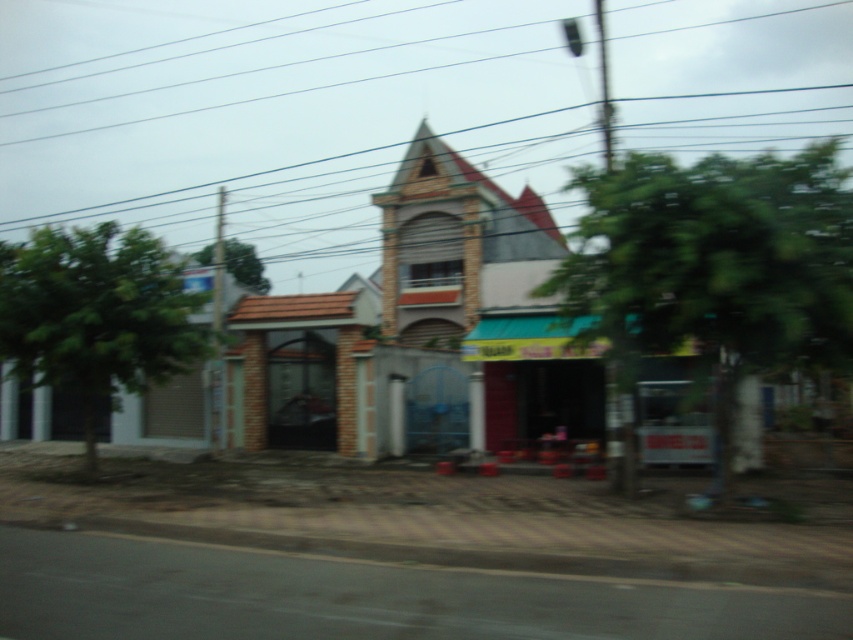
Who is positioned more to the right, green leafy tree at center or green leafy tree at upper center?

green leafy tree at center

This screenshot has width=853, height=640. What do you see at coordinates (717, 266) in the screenshot? I see `green leafy tree at center` at bounding box center [717, 266].

Describe the element at coordinates (717, 266) in the screenshot. I see `green leafy tree at center` at that location.

I want to click on green leafy tree at center, so click(717, 266).

Can you confirm if metallic wire at upper center is positioned below green leafy tree at center?

Actually, metallic wire at upper center is above green leafy tree at center.

Does metallic wire at upper center have a smaller size compared to green leafy tree at center?

No.

What do you see at coordinates (280, 115) in the screenshot? The image size is (853, 640). I see `metallic wire at upper center` at bounding box center [280, 115].

The width and height of the screenshot is (853, 640). What are the coordinates of `metallic wire at upper center` in the screenshot? It's located at (280, 115).

Is point (689, 282) closer to camera compared to point (136, 387)?

That is True.

Between point (560, 266) and point (165, 253), which one is positioned behind?

Positioned behind is point (165, 253).

Between point (763, 202) and point (149, 272), which one is positioned in front?

Point (763, 202) is in front.

The height and width of the screenshot is (640, 853). Find the location of `green leafy tree at center`. green leafy tree at center is located at coordinates (717, 266).